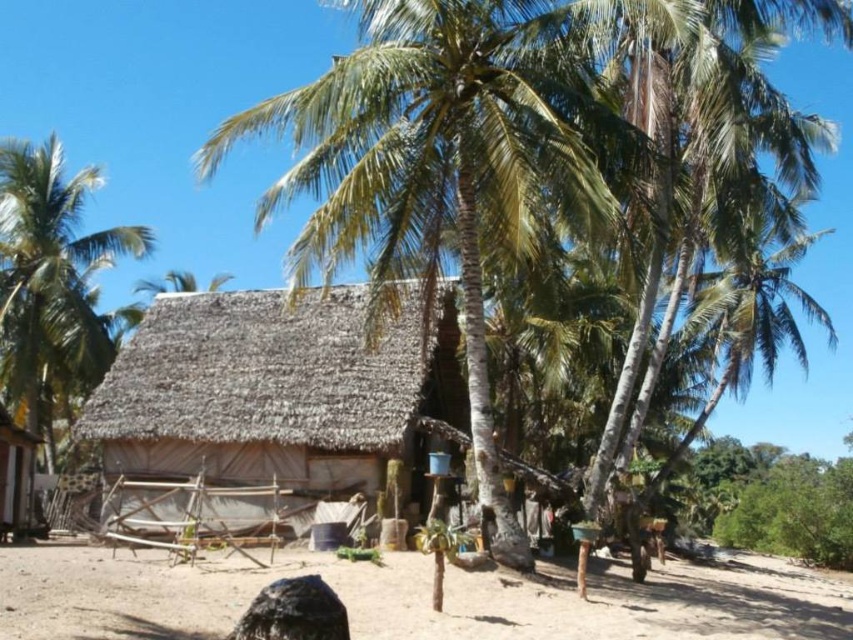
You are standing in front of the thatched roof hut and see the green leafy coconut tree at center and the brown sandy ground at lower center. Which object is located to the right of the other?

The green leafy coconut tree at center is positioned on the right side of brown sandy ground at lower center.

You are standing in front of the thatched roof hut and want to place a small potted plant on the ground. According to the image, where should you place it to ensure it is on the brown sandy ground at lower center?

Place the small potted plant at point (410, 600) to ensure it is on the brown sandy ground at lower center.